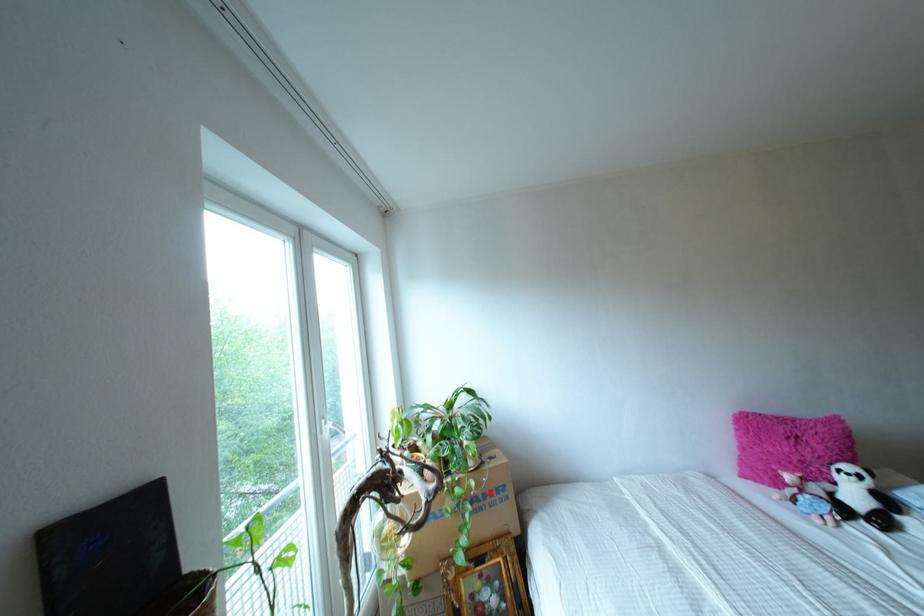
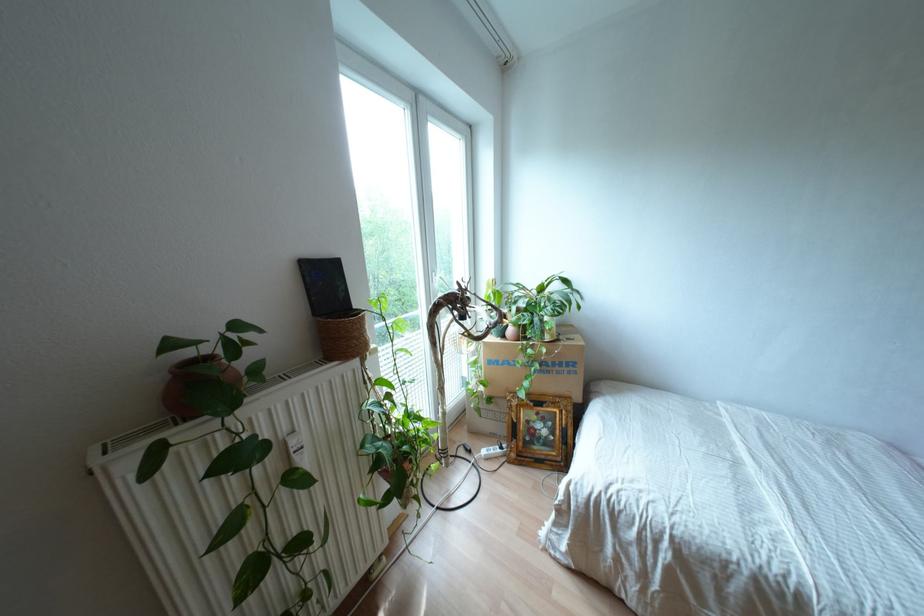
Question: I am providing you with two images of the same scene from different viewpoints. Image1 has a red point marked. In image2, the corresponding 3D location appears at what relative position? Reply with the corresponding letter.

Choices:
 (A) Closer
 (B) Farther

Answer: (A)